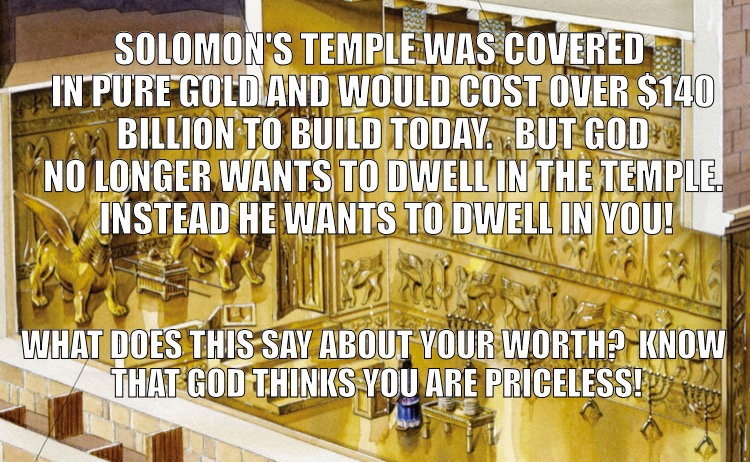
Where is `wall`? wall is located at coordinates (232, 451), (664, 290), (724, 103).